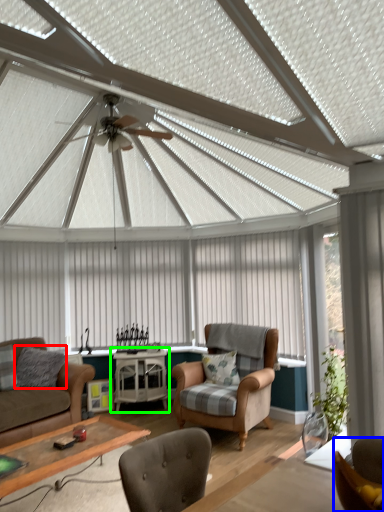
Question: Which object is positioned farthest from pillow (highlighted by a red box)? Select from chair (highlighted by a blue box) and table (highlighted by a green box).

Choices:
 (A) chair
 (B) table

Answer: (A)